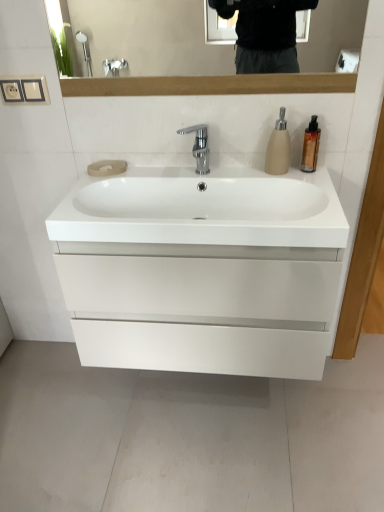
This screenshot has width=384, height=512. I want to click on free space in front of gold metallic soap dispenser at upper right, which is the first soap dispenser from right to left, so click(x=314, y=184).